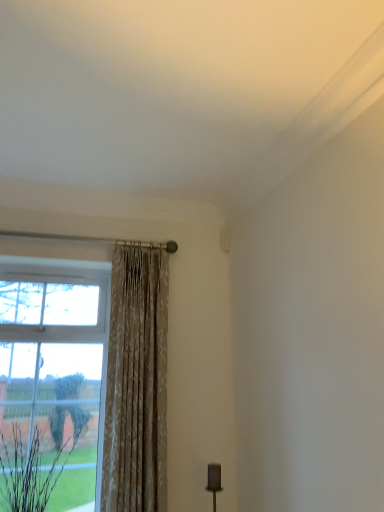
You are a GUI agent. You are given a task and a screenshot of the screen. Output one action in this format:
    pyautogui.click(x=<x>, y=<y>)
    Task: Click on the floral fabric curtain at left
    
    Given the screenshot: What is the action you would take?
    pyautogui.click(x=136, y=383)

This screenshot has width=384, height=512. What do you see at coordinates (136, 383) in the screenshot?
I see `floral fabric curtain at left` at bounding box center [136, 383].

Describe the element at coordinates (30, 474) in the screenshot. Image resolution: width=384 pixels, height=512 pixels. I see `brown textured plant at lower left` at that location.

The width and height of the screenshot is (384, 512). I want to click on brown textured plant at lower left, so click(30, 474).

At what (x,y) coordinates should I click in order to perform the action: click on floral fabric curtain at left. Please return your answer as a coordinate pair (x, y). This screenshot has height=512, width=384. Looking at the image, I should click on pyautogui.click(x=136, y=383).

Would you say brown textured plant at lower left is to the left or to the right of floral fabric curtain at left in the picture?

Based on their positions, brown textured plant at lower left is located to the left of floral fabric curtain at left.

Who is more distant, brown textured plant at lower left or floral fabric curtain at left?

floral fabric curtain at left is further away from the camera.

Which is in front, point (21, 463) or point (140, 411)?

The point (21, 463) is in front.

From the image's perspective, is brown textured plant at lower left above floral fabric curtain at left?

Actually, brown textured plant at lower left appears below floral fabric curtain at left in the image.

From a real-world perspective, who is located lower, brown textured plant at lower left or floral fabric curtain at left?

brown textured plant at lower left, from a real-world perspective.

In terms of width, does brown textured plant at lower left look wider or thinner when compared to floral fabric curtain at left?

In the image, brown textured plant at lower left appears to be wider than floral fabric curtain at left.

Considering the relative sizes of brown textured plant at lower left and floral fabric curtain at left in the image provided, is brown textured plant at lower left taller than floral fabric curtain at left?

In fact, brown textured plant at lower left may be shorter than floral fabric curtain at left.

Can you confirm if brown textured plant at lower left is bigger than floral fabric curtain at left?

No.

Would you say brown textured plant at lower left contains floral fabric curtain at left?

No.

Are brown textured plant at lower left and floral fabric curtain at left beside each other?

No, brown textured plant at lower left is not beside floral fabric curtain at left.

Is brown textured plant at lower left facing towards floral fabric curtain at left?

No, brown textured plant at lower left is not aimed at floral fabric curtain at left.

Where is `curtain behind the brown textured plant at lower left`? The height and width of the screenshot is (512, 384). curtain behind the brown textured plant at lower left is located at coordinates (136, 383).

Can you confirm if floral fabric curtain at left is positioned to the right of brown textured plant at lower left?

Indeed, floral fabric curtain at left is positioned on the right side of brown textured plant at lower left.

Is the position of floral fabric curtain at left more distant than that of brown textured plant at lower left?

Yes, floral fabric curtain at left is behind brown textured plant at lower left.

Is point (147, 281) closer to camera compared to point (17, 432)?

That is False.

From the image's perspective, who appears lower, floral fabric curtain at left or brown textured plant at lower left?

brown textured plant at lower left is shown below in the image.

From a real-world perspective, is floral fabric curtain at left positioned under brown textured plant at lower left based on gravity?

No, from a real-world perspective, floral fabric curtain at left is not beneath brown textured plant at lower left.

Based on the photo, can you confirm if floral fabric curtain at left is thinner than brown textured plant at lower left?

Yes.

In terms of height, does floral fabric curtain at left look taller or shorter compared to brown textured plant at lower left?

Considering their sizes, floral fabric curtain at left has more height than brown textured plant at lower left.

Considering the sizes of objects floral fabric curtain at left and brown textured plant at lower left in the image provided, who is bigger, floral fabric curtain at left or brown textured plant at lower left?

floral fabric curtain at left.

Would you say floral fabric curtain at left is inside or outside brown textured plant at lower left?

floral fabric curtain at left cannot be found inside brown textured plant at lower left.

Is floral fabric curtain at left with brown textured plant at lower left?

No.

Could you tell me if floral fabric curtain at left is facing brown textured plant at lower left?

No, floral fabric curtain at left is not oriented towards brown textured plant at lower left.

How different are the orientations of floral fabric curtain at left and brown textured plant at lower left in degrees?

0.0017 degrees.

Where is `curtain to the right of brown textured plant at lower left`? The width and height of the screenshot is (384, 512). curtain to the right of brown textured plant at lower left is located at coordinates (136, 383).

Image resolution: width=384 pixels, height=512 pixels. I want to click on curtain positioned vertically above the brown textured plant at lower left (from a real-world perspective), so click(x=136, y=383).

Locate an element on the screen. plant below the floral fabric curtain at left (from the image's perspective) is located at coordinates (30, 474).